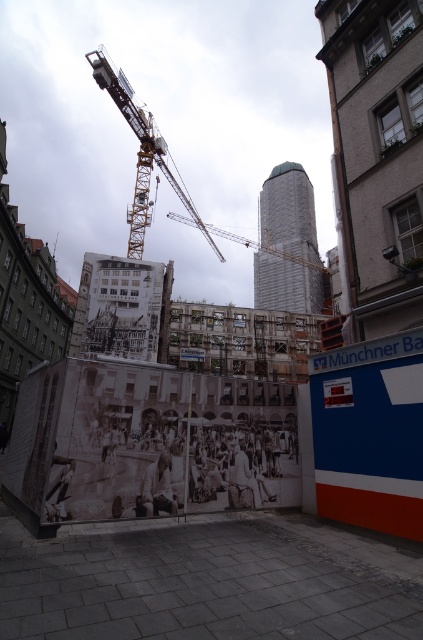
Is point (123, 106) positioned behind point (153, 465)?

Yes, it is behind point (153, 465).

Looking at this image, which is above, yellow metallic crane at upper left or white fabric construction worker at lower center?

Positioned higher is yellow metallic crane at upper left.

Is point (129, 102) farther from camera compared to point (154, 468)?

Yes.

This screenshot has height=640, width=423. What are the coordinates of `yellow metallic crane at upper left` in the screenshot? It's located at (172, 160).